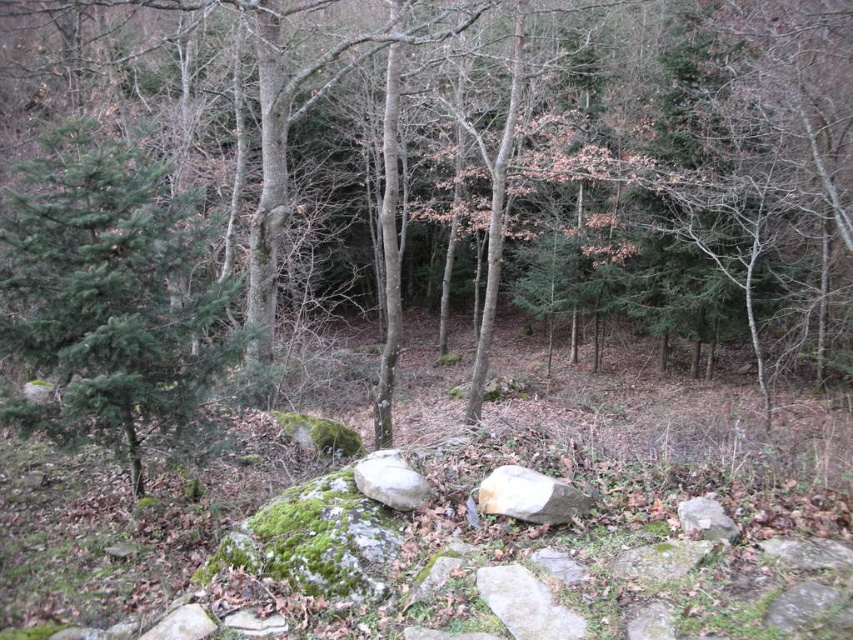
Can you confirm if green needle-like at left is wider than smooth beige rock at center?

Yes, green needle-like at left is wider than smooth beige rock at center.

Is green needle-like at left smaller than smooth beige rock at center?

Actually, green needle-like at left might be larger than smooth beige rock at center.

Which is behind, point (173, 241) or point (512, 499)?

Positioned behind is point (173, 241).

This screenshot has width=853, height=640. Find the location of `green needle-like at left`. green needle-like at left is located at coordinates coord(109,292).

Between point (195, 294) and point (421, 502), which one is positioned in front?

Point (421, 502) is more forward.

Between point (103, 208) and point (373, 492), which one is positioned behind?

The point (103, 208) is behind.

Is point (109, 372) in front of point (355, 468)?

No, (109, 372) is behind (355, 468).

In order to click on green needle-like at left in this screenshot , I will do `click(109, 292)`.

Is smooth beige rock at center closer to camera compared to smooth gray rock at center?

That is True.

Does smooth beige rock at center have a lesser height compared to smooth gray rock at center?

Incorrect, smooth beige rock at center's height does not fall short of smooth gray rock at center's.

Who is more forward, (567,508) or (409,474)?

Point (567,508) is in front.

At what (x,y) coordinates should I click in order to perform the action: click on smooth beige rock at center. Please return your answer as a coordinate pair (x, y). Looking at the image, I should click on (529, 497).